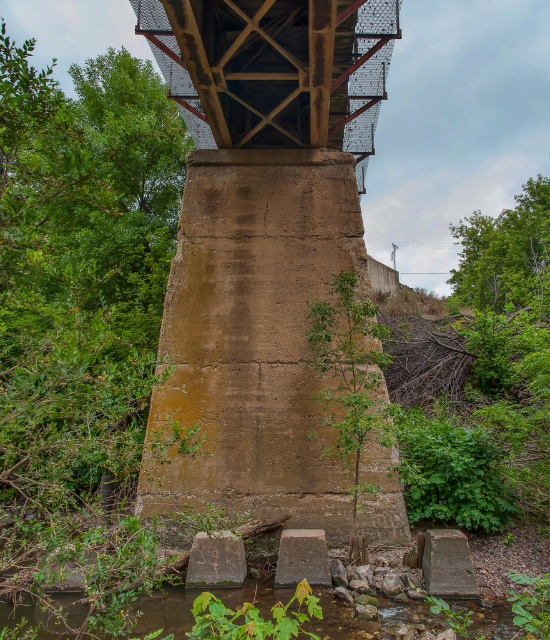
You are standing on the bank of the brown rocky river at lower center and want to cross to the other side. Is the rusty metal bridge at upper center a viable option for crossing the river?

The rusty metal bridge at upper center is positioned over the brown rocky river at lower center, so yes, it is a viable option for crossing the river.

You are standing at the base of the bridge pillar and looking up. There are two points marked on the pillar, one at coordinates point (370, 76) and another at point (3, 609). Which point is closer to your viewpoint?

Point (3, 609) is closer to your viewpoint because it is in front of point (370, 76).

You are a construction worker assessing the bridge structure. You notice the rusty metal bridge at upper center and the brown rocky river at lower center. Which one has a greater width?

The rusty metal bridge at upper center has a greater width than the brown rocky river at lower center.